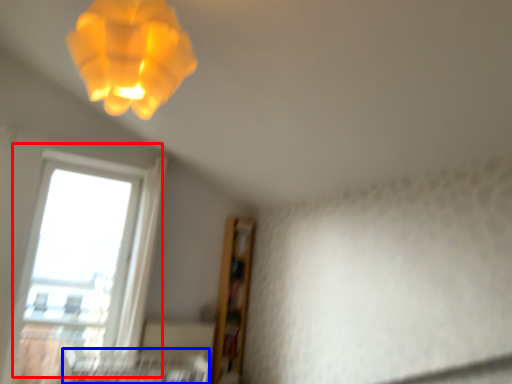
Question: Which point is further to the camera, window (highlighted by a red box) or bed frame (highlighted by a blue box)?

Choices:
 (A) window
 (B) bed frame

Answer: (A)